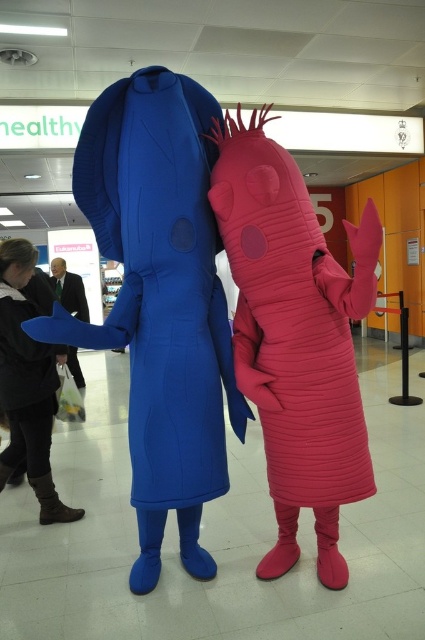
Between matte blue costume at center and matte black suit at center, which one has more height?

Standing taller between the two is matte blue costume at center.

Is matte blue costume at center above matte black suit at center?

No.

You are a GUI agent. You are given a task and a screenshot of the screen. Output one action in this format:
    pyautogui.click(x=<x>, y=<y>)
    Task: Click on the matte blue costume at center
    
    Given the screenshot: What is the action you would take?
    pyautogui.click(x=159, y=300)

Can you confirm if rubber pink worm at center is positioned to the right of matte black suit at center?

Indeed, rubber pink worm at center is positioned on the right side of matte black suit at center.

At what (x,y) coordinates should I click in order to perform the action: click on rubber pink worm at center. Please return your answer as a coordinate pair (x, y). The height and width of the screenshot is (640, 425). Looking at the image, I should click on (294, 337).

Does point (351, 340) come closer to viewer compared to point (59, 289)?

Yes, it is in front of point (59, 289).

The image size is (425, 640). Find the location of `rubber pink worm at center`. rubber pink worm at center is located at coordinates (294, 337).

Who is more distant from viewer, (108,160) or (64,513)?

Point (64,513)

Does matte blue costume at center have a lesser height compared to brown leather boots at lower left?

In fact, matte blue costume at center may be taller than brown leather boots at lower left.

What do you see at coordinates (159, 300) in the screenshot?
I see `matte blue costume at center` at bounding box center [159, 300].

This screenshot has width=425, height=640. Find the location of `matte blue costume at center`. matte blue costume at center is located at coordinates [159, 300].